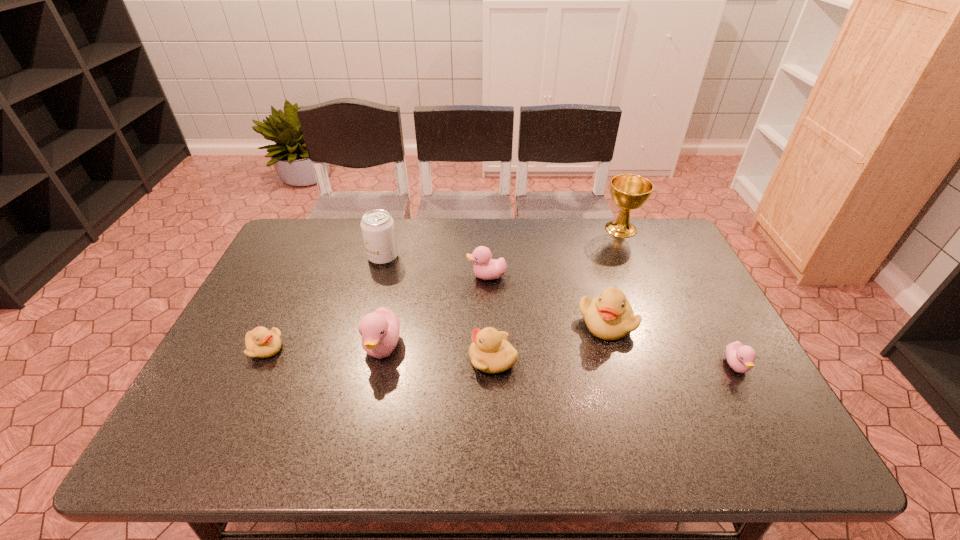
The image size is (960, 540). In order to click on blank region between the rightmost pink duckling and the fifth duckling from left to right in this screenshot , I will do `click(671, 344)`.

Where is `vacant area between the seventh nearest object and the farthest duckling`? The width and height of the screenshot is (960, 540). vacant area between the seventh nearest object and the farthest duckling is located at coordinates (435, 267).

At what (x,y) coordinates should I click in order to perform the action: click on vacant point located between the rightmost yellow duckling and the leftmost duckling. Please return your answer as a coordinate pair (x, y). This screenshot has width=960, height=540. Looking at the image, I should click on (436, 335).

Where is `object that is the third closest to the seventh nearest object`? This screenshot has width=960, height=540. object that is the third closest to the seventh nearest object is located at coordinates (260, 342).

You are a GUI agent. You are given a task and a screenshot of the screen. Output one action in this format:
    pyautogui.click(x=<x>, y=<y>)
    Task: Click on the object that is the closest to the soda can
    This screenshot has width=960, height=540.
    Given the screenshot: What is the action you would take?
    485,268

Locate an element on the screen. The height and width of the screenshot is (540, 960). duckling that is the fifth closest to the second yellow duckling from left to right is located at coordinates (740, 357).

Identify the location of the second closest duckling to the leftmost pink duckling. (260, 342).

Locate an element on the screen. pink duckling that is the nearest to the farthest object is located at coordinates (485, 268).

Select which pink duckling is the second closest to the rightmost pink duckling. Please provide its 2D coordinates. Your answer should be formatted as a tuple, i.e. [(x, y)], where the tuple contains the x and y coordinates of a point satisfying the conditions above.

[(380, 330)]

You are a GUI agent. You are given a task and a screenshot of the screen. Output one action in this format:
    pyautogui.click(x=<x>, y=<y>)
    Task: Click on the second closest yellow duckling relative to the fifth duckling from left to right
    This screenshot has width=960, height=540.
    Given the screenshot: What is the action you would take?
    pyautogui.click(x=260, y=342)